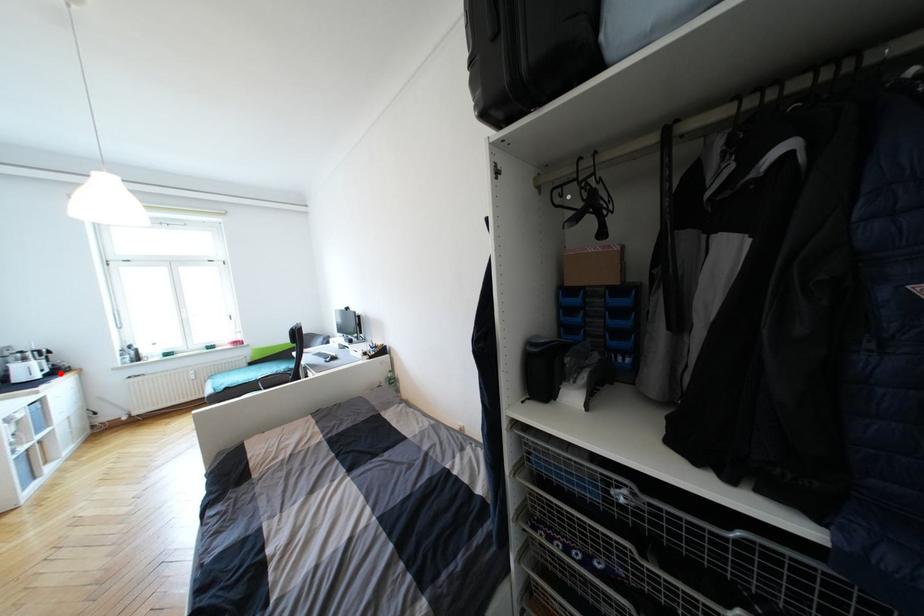
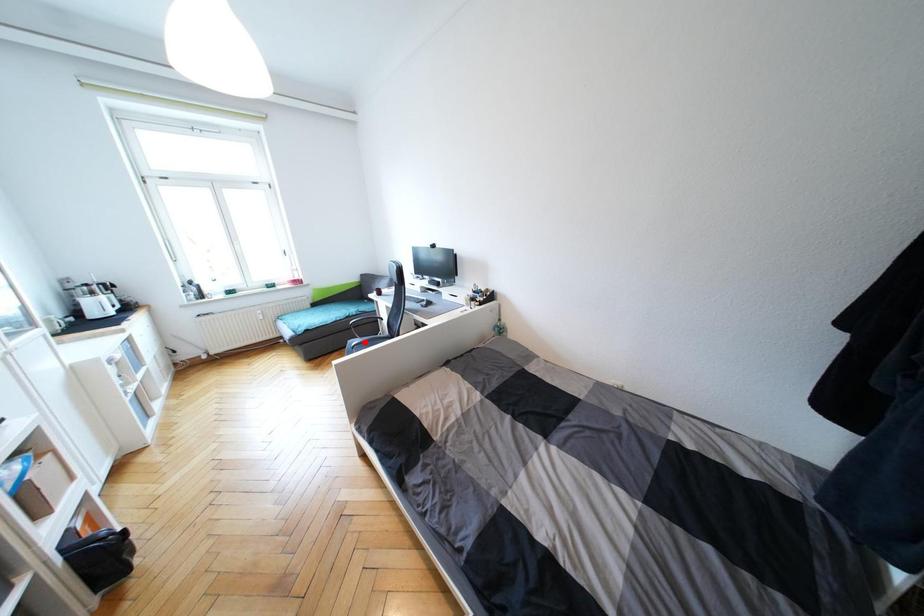
I am providing you with two images of the same scene from different viewpoints. A red point is marked on the first image and another point is marked on the second image. Is the marked point in image1 the same physical position as the marked point in image2?

No